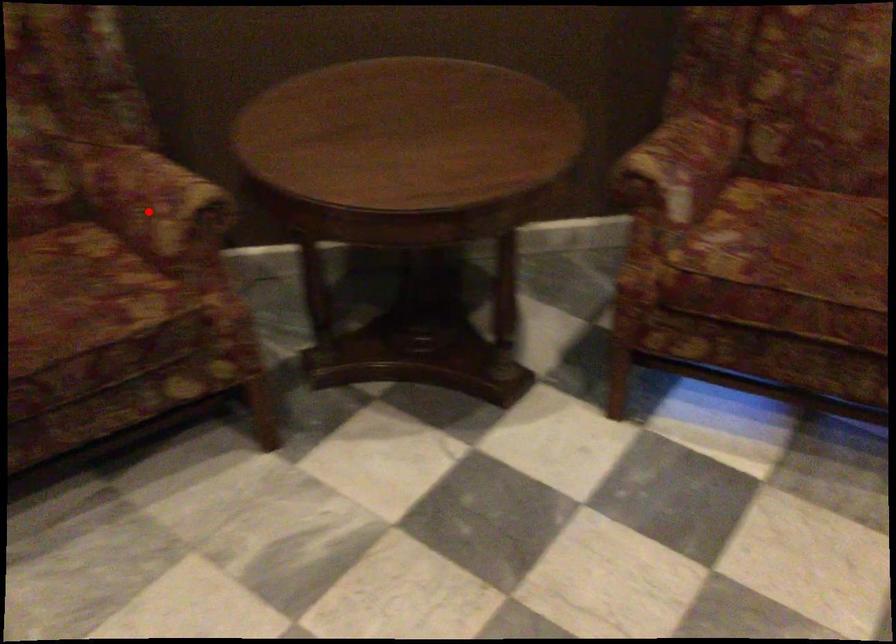
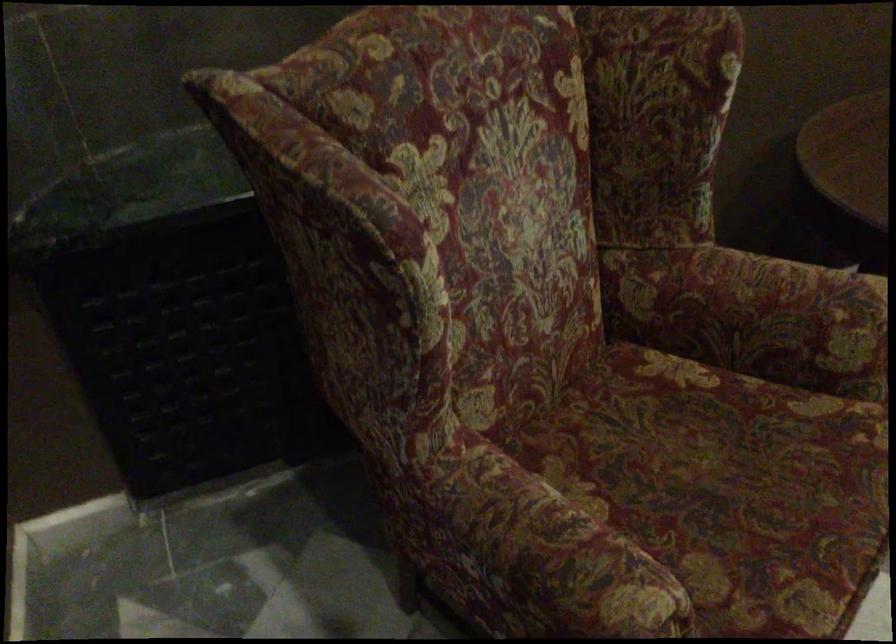
The point at the highlighted location is marked in the first image. Where is the corresponding point in the second image?

(786, 321)